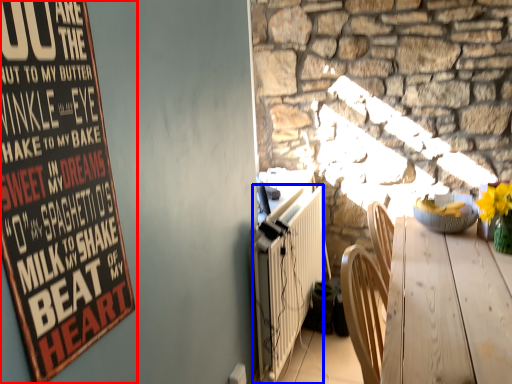
Question: Which object appears farthest to the camera in this image, poster (highlighted by a red box) or radiator (highlighted by a blue box)?

Choices:
 (A) poster
 (B) radiator

Answer: (B)